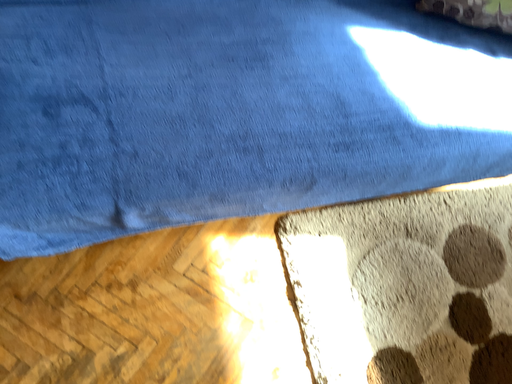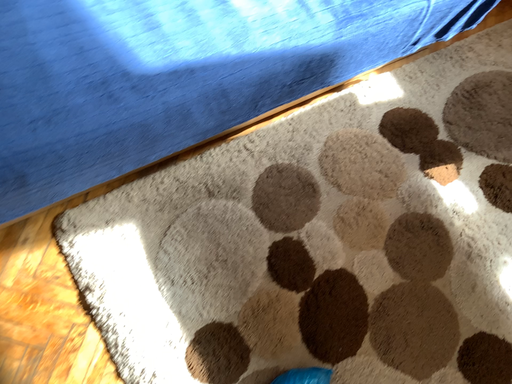
Question: Which way did the camera rotate in the video?

Choices:
 (A) rotated left
 (B) rotated right

Answer: (B)